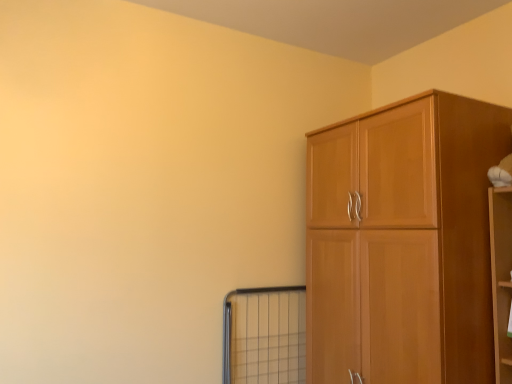
Question: From the image's perspective, is metal grid window at lower center located above or below light brown wood cupboard at right?

Choices:
 (A) below
 (B) above

Answer: (A)

Question: From a real-world perspective, is metal grid window at lower center physically located above or below light brown wood cupboard at right?

Choices:
 (A) above
 (B) below

Answer: (B)

Question: In terms of size, does metal grid window at lower center appear bigger or smaller than light brown wood cupboard at right?

Choices:
 (A) small
 (B) big

Answer: (A)

Question: Is light brown wood cupboard at right taller or shorter than metal grid window at lower center?

Choices:
 (A) short
 (B) tall

Answer: (B)

Question: Visually, is light brown wood cupboard at right positioned to the left or to the right of metal grid window at lower center?

Choices:
 (A) right
 (B) left

Answer: (A)

Question: From the image's perspective, relative to metal grid window at lower center, is light brown wood cupboard at right above or below?

Choices:
 (A) above
 (B) below

Answer: (A)

Question: Based on their sizes in the image, would you say light brown wood cupboard at right is bigger or smaller than metal grid window at lower center?

Choices:
 (A) small
 (B) big

Answer: (B)